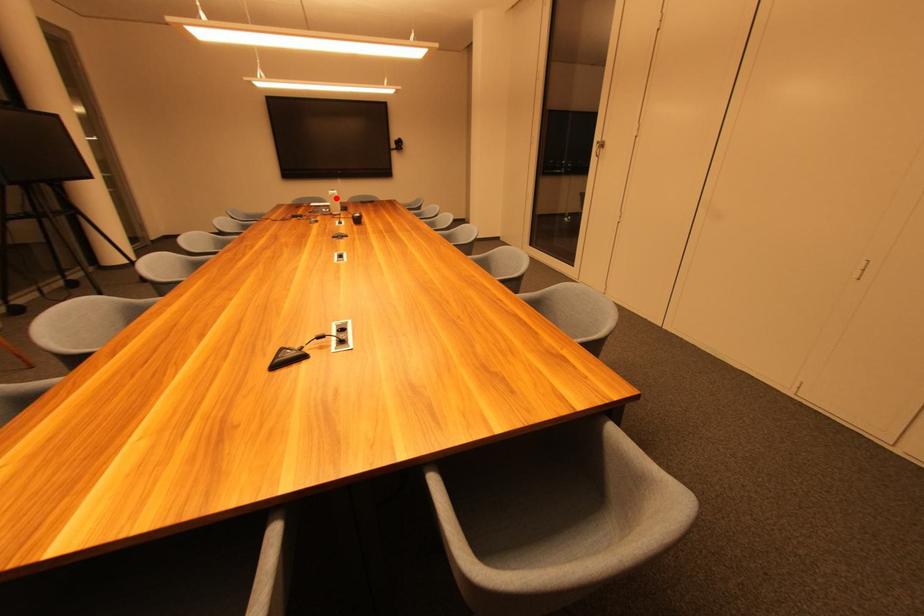
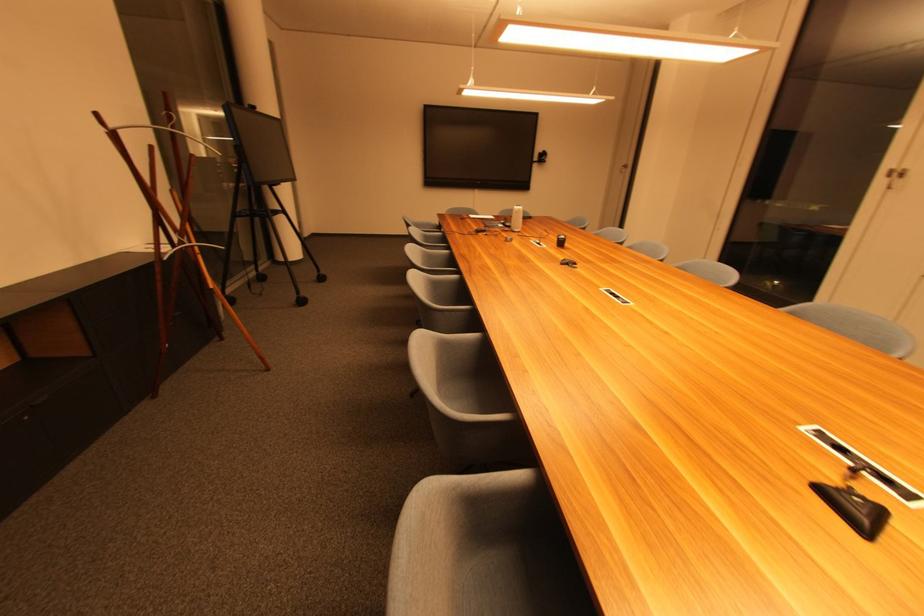
Question: I am providing you with two images of the same scene from different viewpoints. A red point is shown in image1. For the corresponding object point in image2, is it positioned nearer or farther from the camera?

Choices:
 (A) Nearer
 (B) Farther

Answer: (A)